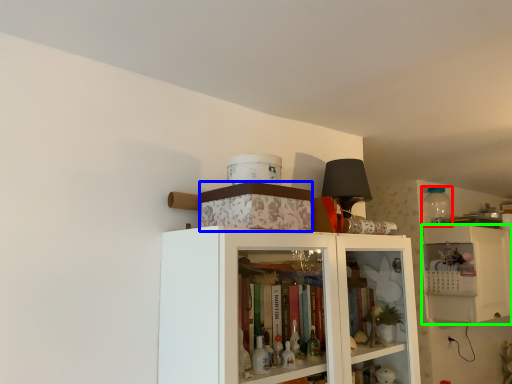
Question: Which object is positioned closest to bottle (highlighted by a red box)? Select from box (highlighted by a blue box) and cabinetry (highlighted by a green box).

Choices:
 (A) box
 (B) cabinetry

Answer: (B)